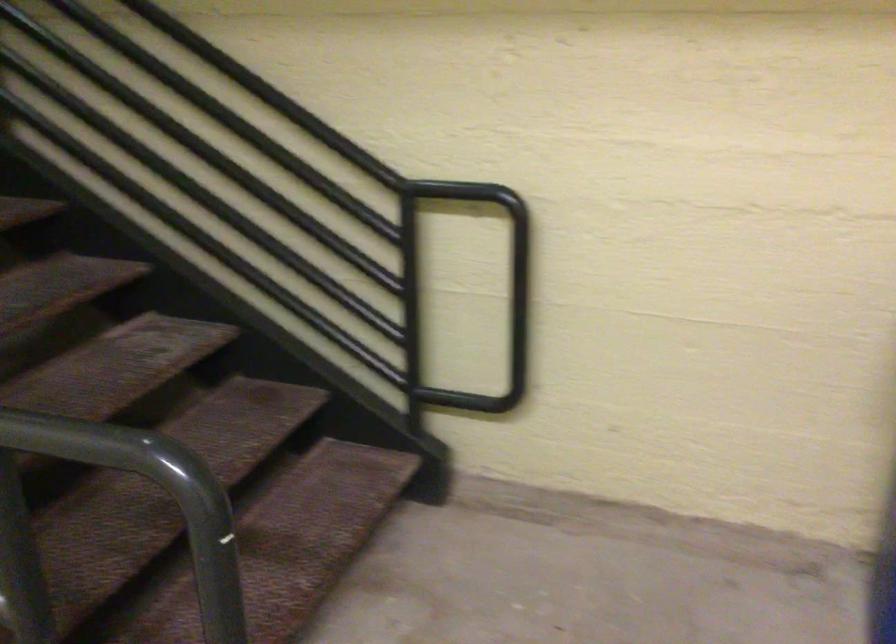
What do you see at coordinates (115, 518) in the screenshot?
I see `the black railing handle` at bounding box center [115, 518].